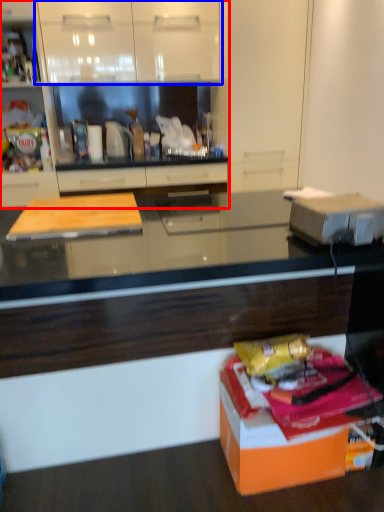
Question: Which point is closer to the camera, cabinetry (highlighted by a red box) or cabinetry (highlighted by a blue box)?

Choices:
 (A) cabinetry
 (B) cabinetry

Answer: (A)